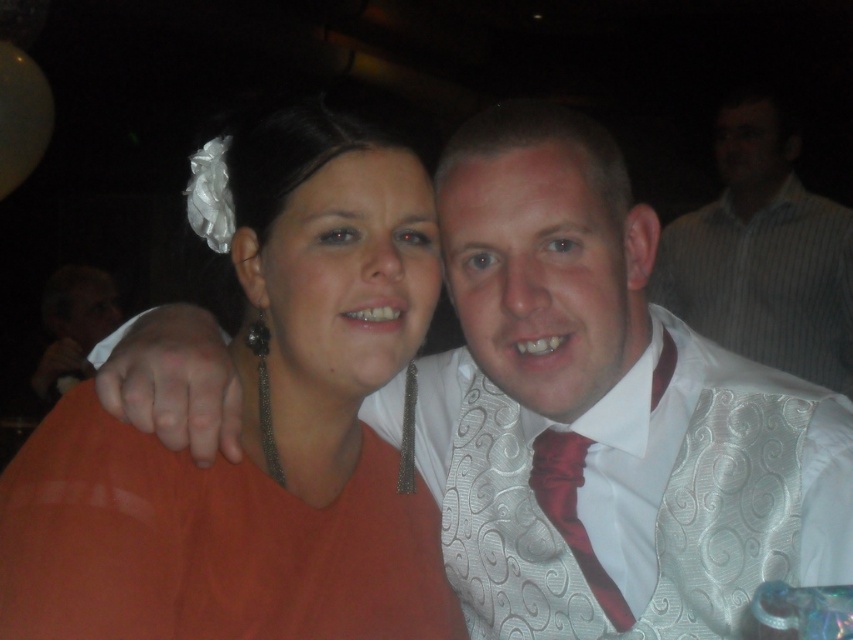
You are a photographer setting up for a group photo. You need to ensure that both the white textured dress shirt at center and the orange fabric dress at center are fully visible in the frame. Based on their widths, which one might require more space to accommodate in the photo?

The white textured dress shirt at center might be wider than the orange fabric dress at center, so it might require more space to accommodate in the photo.

You are trying to place a small pin at point (763,252) on the image. Which object from the following list is located at that coordinate? The options are the vibrant orange top on the left and the white textured shirt at upper right.

The point (763,252) is located on the white textured shirt at upper right.

You are a photographer at a wedding reception. You need to ensure that the white textured shirt at upper right and the shiny red tie at center are both visible in the photo. Given their sizes, which object might require more careful framing to ensure it doesn not get lost in the image?

The shiny red tie at center has a smaller size compared to the white textured shirt at upper right, so it might require more careful framing to ensure it doesn not get lost in the image.